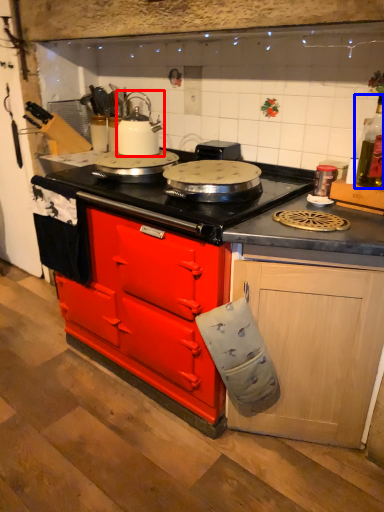
Question: Which of the following is the farthest to the observer, kitchen appliance (highlighted by a red box) or bottle (highlighted by a blue box)?

Choices:
 (A) kitchen appliance
 (B) bottle

Answer: (A)